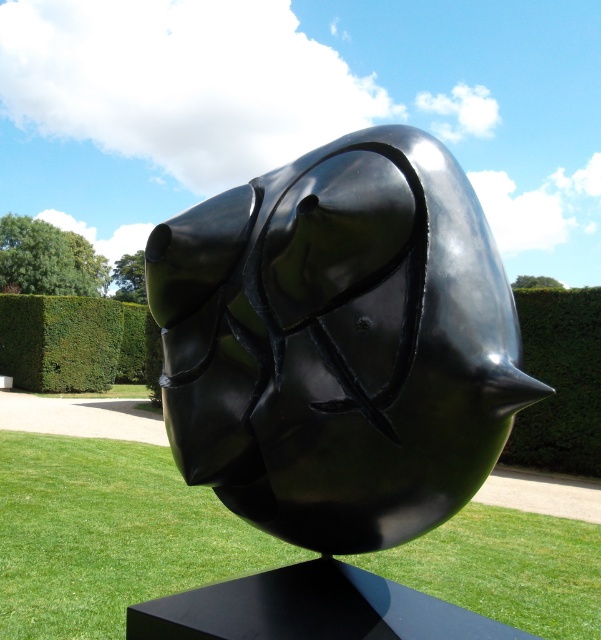
You are a landscape architect designing a pathway that needs to pass between the green hedge at right and the green leafy hedge at center. Which hedge should the pathway be closer to if the path must stay equidistant from both hedges but avoid the larger one? Please explain your reasoning.

The pathway should be closer to the green leafy hedge at center because the green hedge at right is bigger. By positioning the path nearer to the smaller hedge, it maintains an equal distance from both while avoiding the larger hedge as required.

Based on the photo, you are a landscape architect planning to install a new pathway between the green hedge at right and the green leafy hedge at center. Considering their heights, which hedge might block the view from the pathway more when viewed from the front?

The green hedge at right has a greater height compared to the green leafy hedge at center, so it would block the view more from the front.

You are standing in a garden with a glossy black sculpture at center. If you want to take a photo of the sculpture, where should you position yourself to ensure it is centered in your camera frame?

Position yourself directly in front of the glossy black sculpture at center, which is located at coordinates point (338, 342), to ensure it is centered in your camera frame.